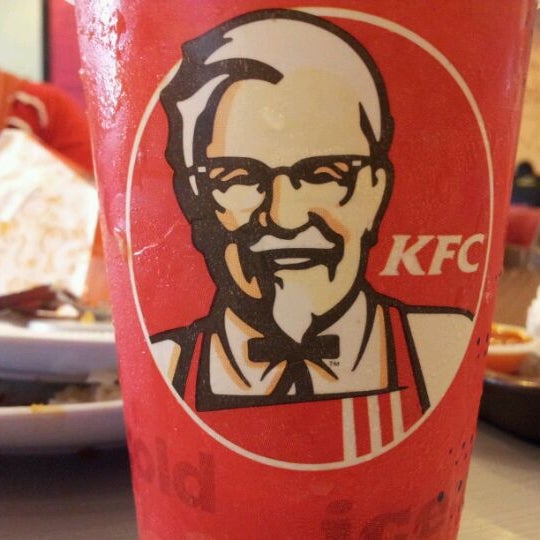
Locate an element on the screen. table is located at coordinates (497, 485).